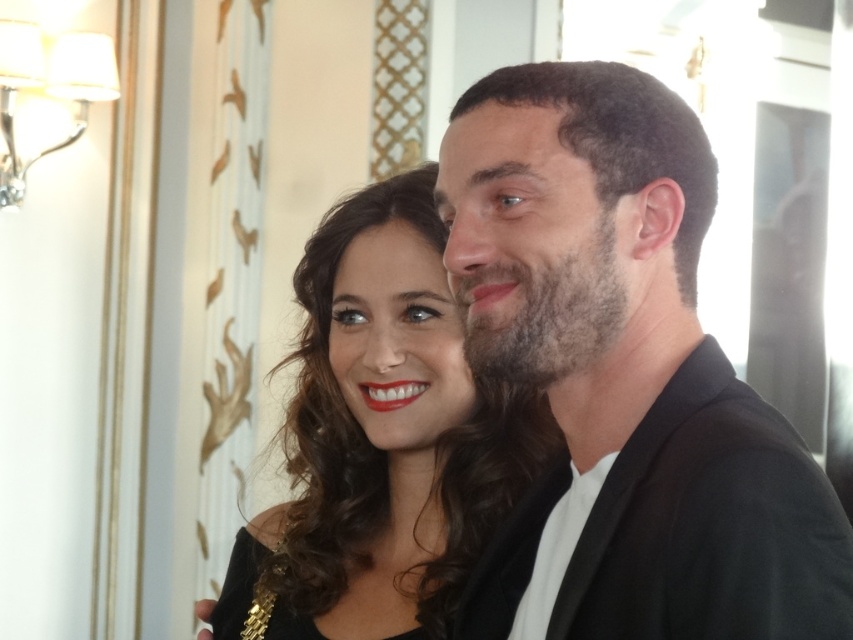
You are a photographer setting up for a group photo. You need to ensure that the smooth black jacket at right and the dark brown hair at center are both visible in the frame. Based on their sizes, which object should you focus on to ensure both are in focus?

The smooth black jacket at right is taller than dark brown hair at center, so focusing on the smooth black jacket at right will help ensure both are in focus as it is the larger object.